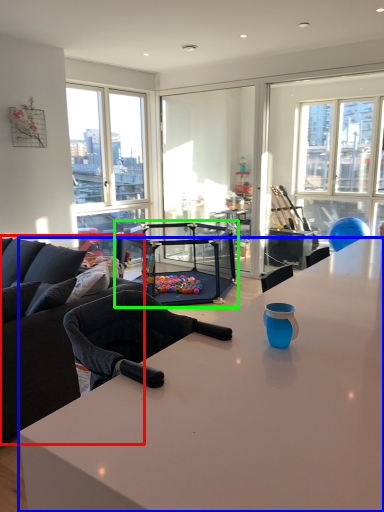
Question: Which object is the closest to the studio couch (highlighted by a red box)? Choose among these: desk (highlighted by a blue box) or equipment (highlighted by a green box).

Choices:
 (A) desk
 (B) equipment

Answer: (A)